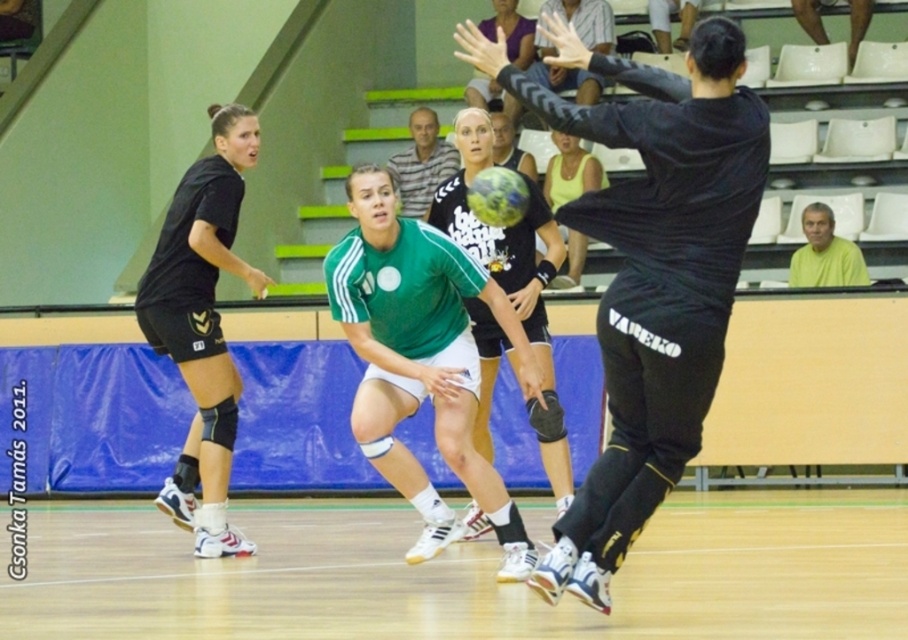
Question: Does gray striped shirt at center appear over yellow matte shirt at upper right?

Choices:
 (A) yes
 (B) no

Answer: (A)

Question: Among these points, which one is nearest to the camera?

Choices:
 (A) (417, 112)
 (B) (864, 269)

Answer: (B)

Question: Which object is closer to the camera taking this photo?

Choices:
 (A) black matte shorts at left
 (B) gray striped shirt at center

Answer: (A)

Question: Is black matte jersey at center thinner than gray striped shirt at center?

Choices:
 (A) yes
 (B) no

Answer: (B)

Question: Which point is farther to the camera?

Choices:
 (A) gray striped shirt at center
 (B) yellow matte shirt at upper right
 (C) black matte shorts at left
 (D) black matte jersey at center

Answer: (A)

Question: Can you confirm if black matte jersey at center is wider than gray striped shirt at center?

Choices:
 (A) yes
 (B) no

Answer: (A)